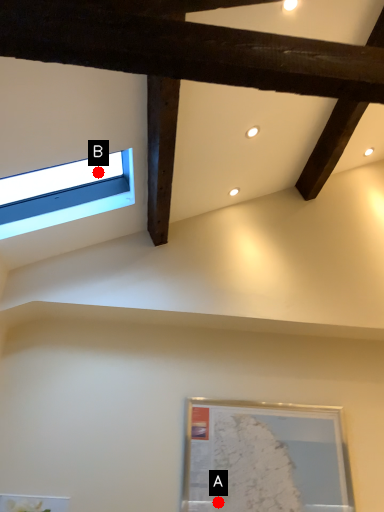
Question: Two points are circled on the image, labeled by A and B beside each circle. Which point is further to the camera?

Choices:
 (A) A is further
 (B) B is further

Answer: (B)